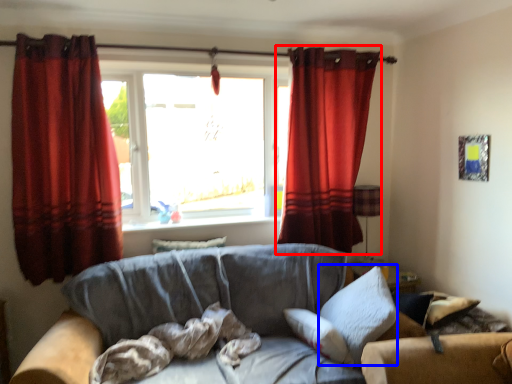
Question: Which object appears farthest to the camera in this image, curtain (highlighted by a red box) or pillow (highlighted by a blue box)?

Choices:
 (A) curtain
 (B) pillow

Answer: (A)